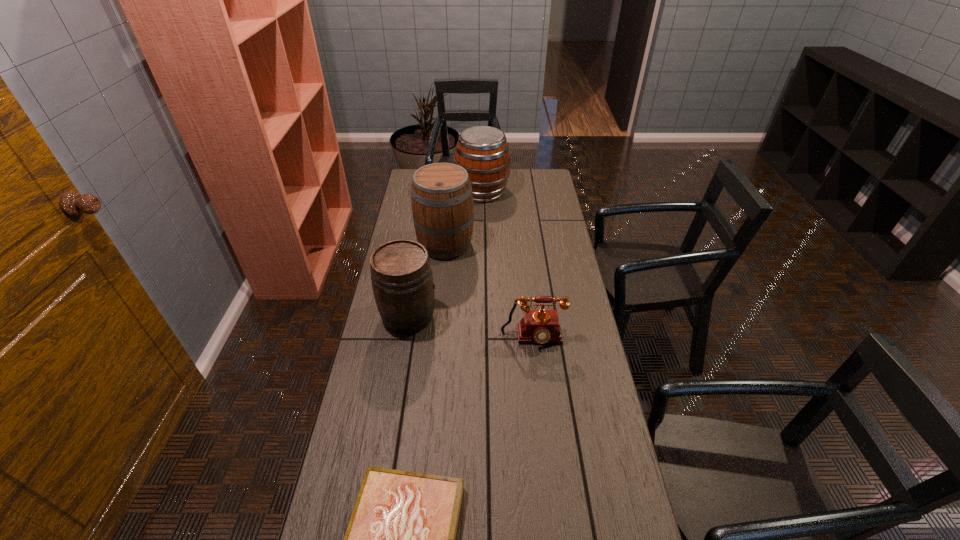
Image resolution: width=960 pixels, height=540 pixels. I want to click on the second farthest cider, so click(x=442, y=203).

Find the location of a particular element. The image size is (960, 540). the farthest cider is located at coordinates (482, 151).

Locate an element on the screen. the nearest cider is located at coordinates (402, 281).

This screenshot has width=960, height=540. In order to click on telephone in this screenshot , I will do `click(542, 326)`.

Where is `free location located on the right of the second nearest cider`? This screenshot has width=960, height=540. free location located on the right of the second nearest cider is located at coordinates (552, 245).

Identify the location of vacant space positioned 0.180m on the front of the farthest cider. (482, 228).

What are the coordinates of `vacant region located 0.080m on the side of the nearest cider near the bung hole` in the screenshot? It's located at (460, 316).

Find the location of `vacant point located on the dial of the telephone`. vacant point located on the dial of the telephone is located at coordinates click(x=540, y=403).

This screenshot has height=540, width=960. Identify the location of object present at the far edge. (482, 151).

Where is `object situated at the right edge`? This screenshot has height=540, width=960. object situated at the right edge is located at coordinates (542, 326).